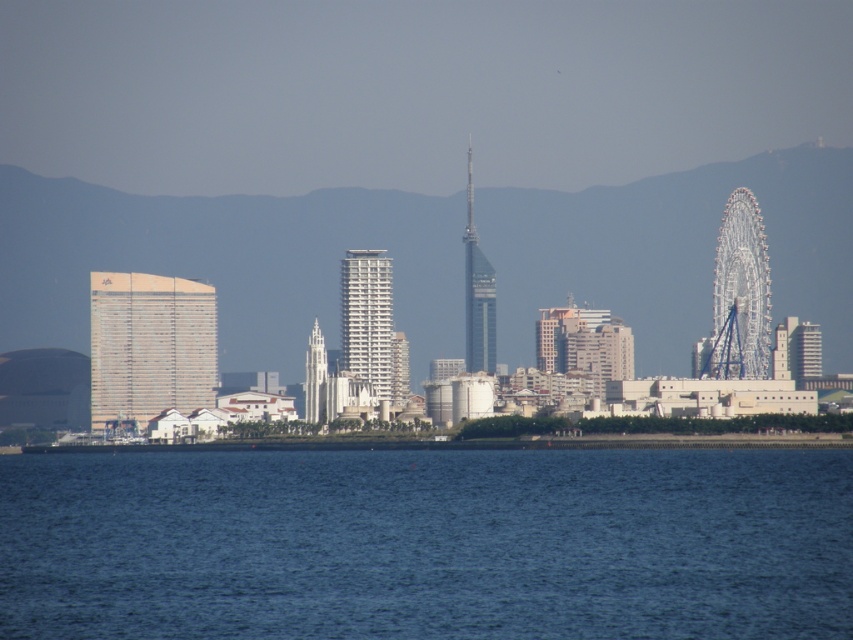
Between white metallic ferris wheel at right and white glossy building at center, which one is positioned lower?

Positioned lower is white glossy building at center.

Does point (747, 356) lie behind point (360, 368)?

Yes, it is.

Is point (751, 266) farther from camera compared to point (393, 330)?

Yes.

I want to click on white metallic ferris wheel at right, so click(743, 278).

Which is behind, point (99, 314) or point (752, 371)?

Positioned behind is point (752, 371).

Is point (178, 285) farther from viewer compared to point (744, 337)?

No, it is in front of (744, 337).

Is point (175, 330) positioned behind point (756, 220)?

That is False.

Where is `gold metallic building at left`? The width and height of the screenshot is (853, 640). gold metallic building at left is located at coordinates (149, 346).

Between point (15, 468) and point (316, 356), which one is positioned in front?

Positioned in front is point (316, 356).

Does blue liquid water at lower center have a lesser width compared to white stone tower at center?

Incorrect, blue liquid water at lower center's width is not less than white stone tower at center's.

The height and width of the screenshot is (640, 853). Identify the location of blue liquid water at lower center. (427, 544).